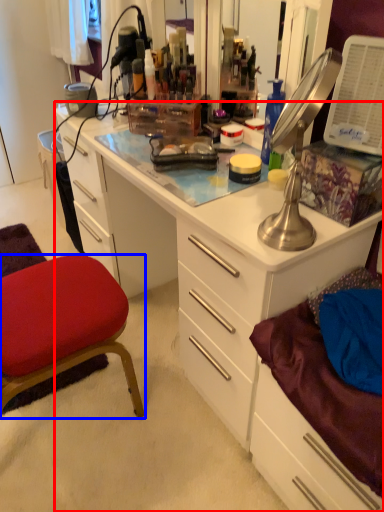
Question: Which object is further to the camera taking this photo, desk (highlighted by a red box) or chair (highlighted by a blue box)?

Choices:
 (A) desk
 (B) chair

Answer: (B)